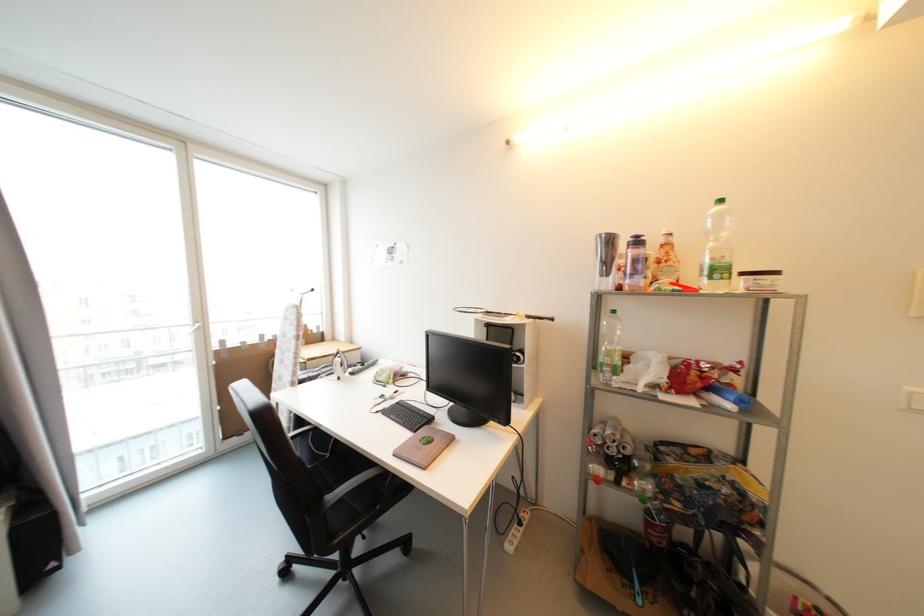
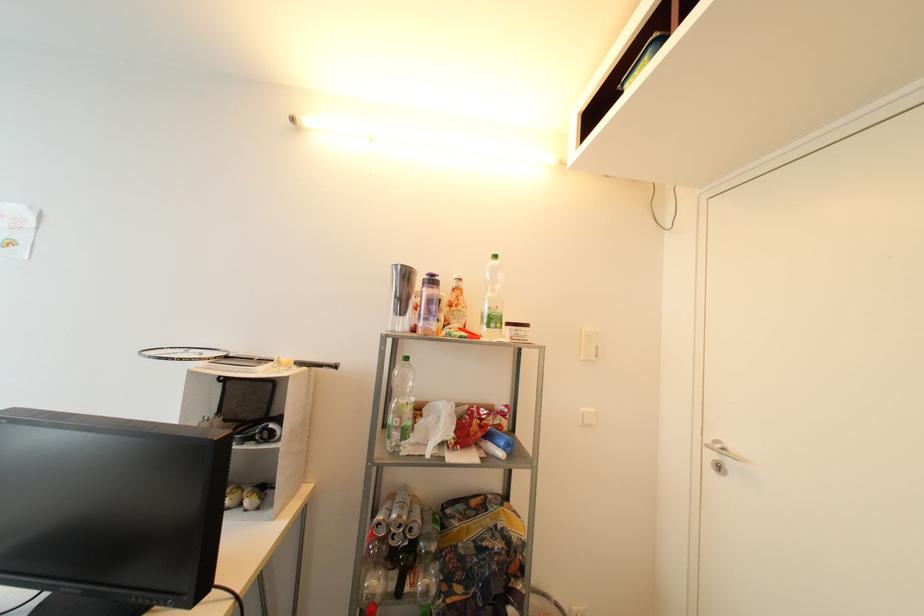
Where in the second image is the point corresponding to the point at 672,262 from the first image?

(462, 307)